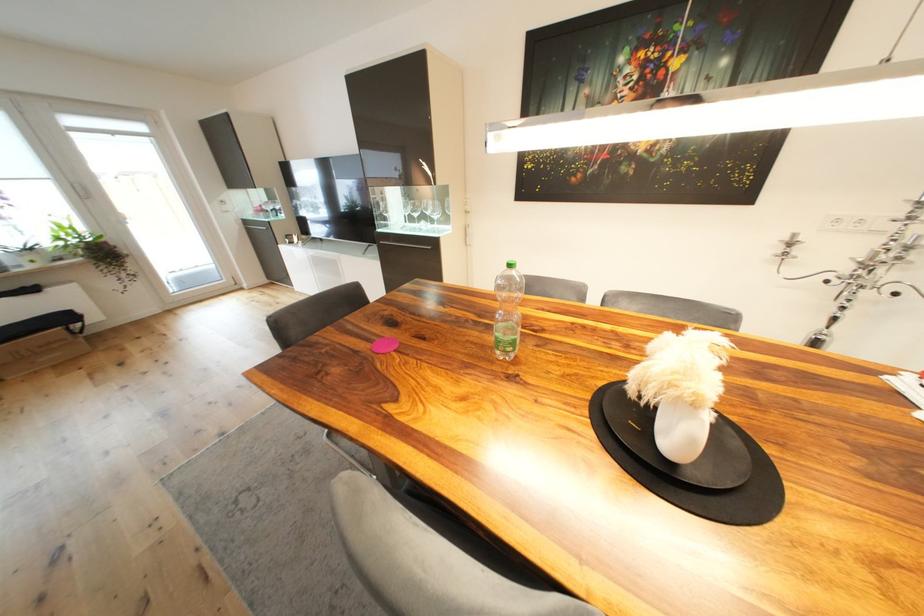
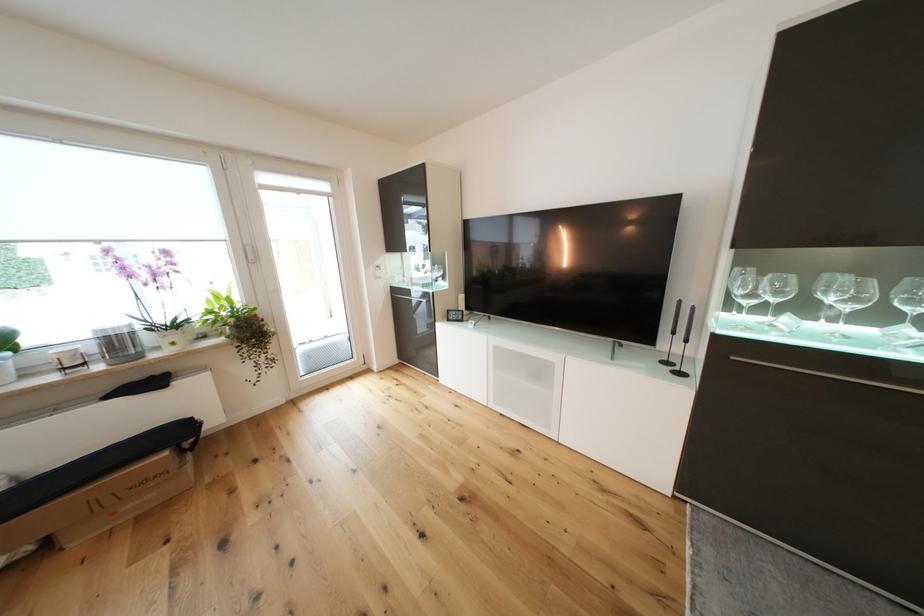
Which direction would the cameraman need to move to produce the second image?

The cameraman moved toward left, forward.